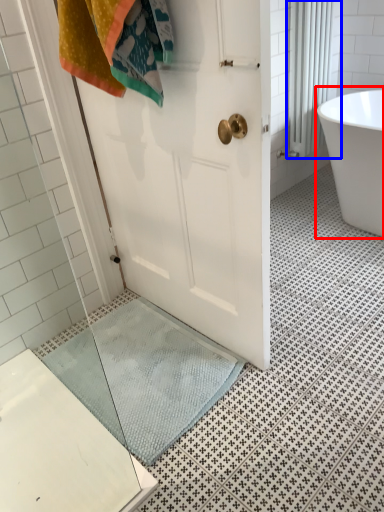
Question: Among these objects, which one is farthest to the camera, bathtub (highlighted by a red box) or shower curtain (highlighted by a blue box)?

Choices:
 (A) bathtub
 (B) shower curtain

Answer: (B)